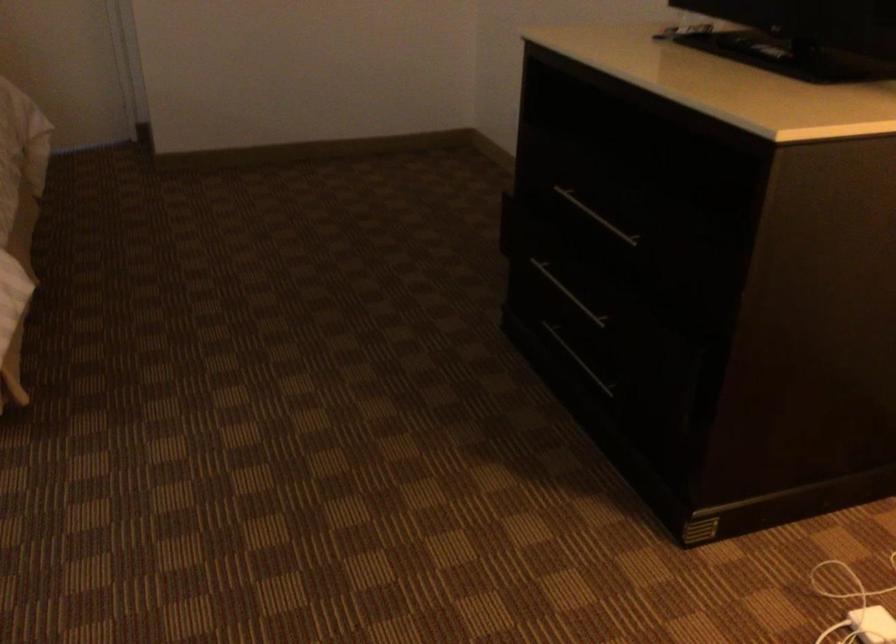
Find where to plugg the white power adapter. Please return your answer as a coordinate pair (x, y).

(872, 625)